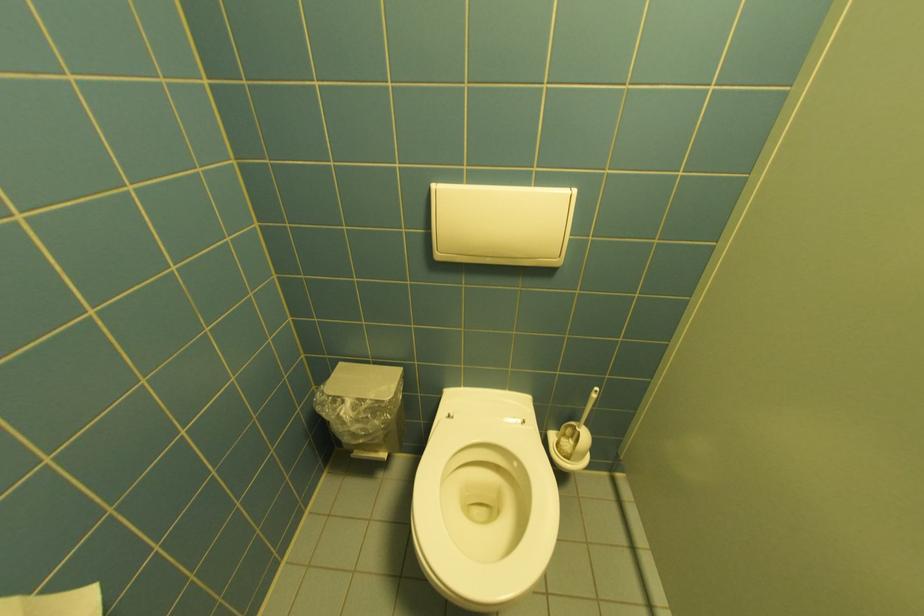
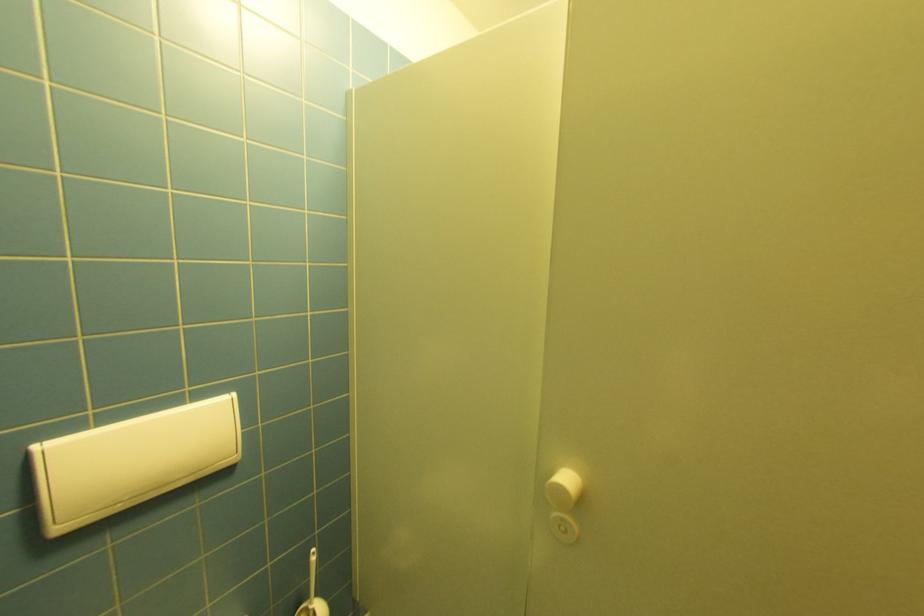
Find the pixel in the second image that matches (444,256) in the first image.

(66, 530)